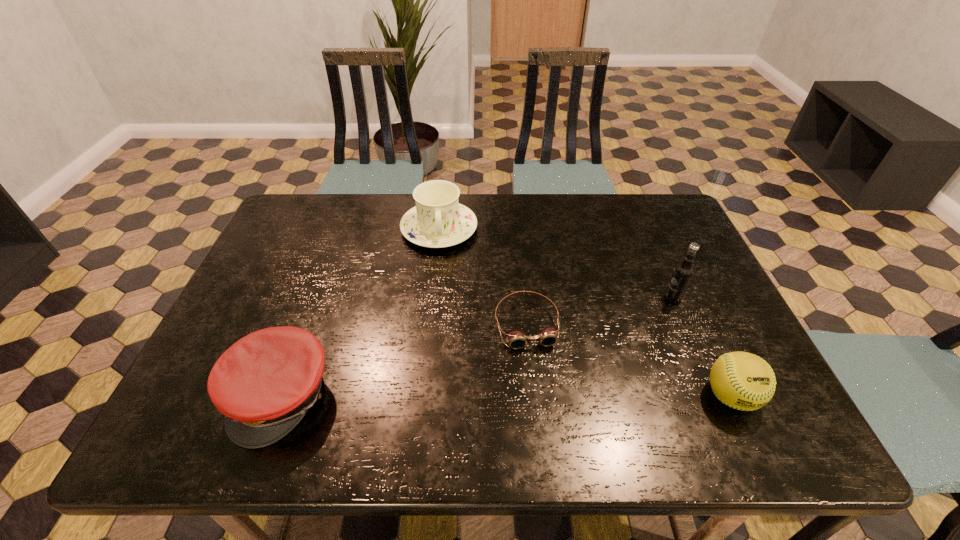
Where is `cap`? cap is located at coordinates (264, 384).

This screenshot has height=540, width=960. Identify the location of softball. (741, 380).

You are a GUI agent. You are given a task and a screenshot of the screen. Output one action in this format:
    pyautogui.click(x=<x>, y=<y>)
    Task: Click on the fourth object from right to left
    The height and width of the screenshot is (540, 960).
    Given the screenshot: What is the action you would take?
    pyautogui.click(x=438, y=220)

Locate an element on the screen. Image resolution: width=960 pixels, height=540 pixels. the farthest object is located at coordinates (438, 220).

Where is `the third object from left to right`? The image size is (960, 540). the third object from left to right is located at coordinates [x=516, y=339].

Where is `the shortest object`? This screenshot has height=540, width=960. the shortest object is located at coordinates (516, 339).

This screenshot has width=960, height=540. I want to click on root beer, so click(683, 272).

Where is `free point located on the handle side of the farthest object`? free point located on the handle side of the farthest object is located at coordinates (444, 282).

Where is `vacant space located 0.310m on the handle side of the farthest object`? vacant space located 0.310m on the handle side of the farthest object is located at coordinates (448, 338).

Where is `free space located on the handle side of the farthest object`? free space located on the handle side of the farthest object is located at coordinates (447, 319).